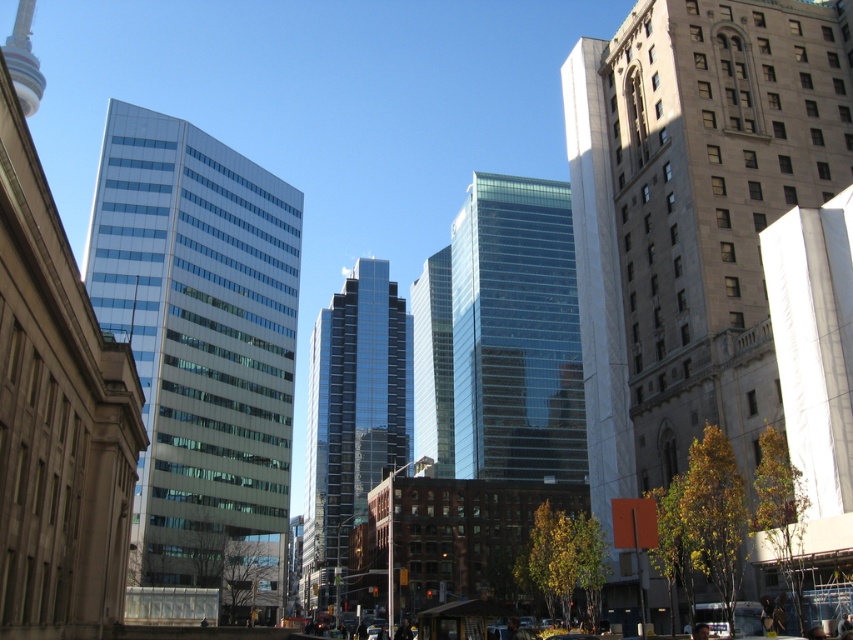
Is transparent glass building at center to the right of shiny glass skyscraper at center from the viewer's perspective?

Correct, you'll find transparent glass building at center to the right of shiny glass skyscraper at center.

Which is below, transparent glass building at center or shiny glass skyscraper at center?

Positioned lower is shiny glass skyscraper at center.

Does point (450, 237) come farther from viewer compared to point (387, 396)?

Yes.

Locate an element on the screen. This screenshot has height=640, width=853. transparent glass building at center is located at coordinates (515, 332).

Which is behind, point (177, 477) or point (567, 445)?

Point (567, 445)

What do you see at coordinates (201, 349) in the screenshot?
I see `matte glass building at left` at bounding box center [201, 349].

Locate an element on the screen. This screenshot has height=640, width=853. matte glass building at left is located at coordinates (x=201, y=349).

Where is `matte glass building at left`? This screenshot has height=640, width=853. matte glass building at left is located at coordinates (201, 349).

Which is in front, point (242, 230) or point (593, 464)?

Point (593, 464) is in front.

Who is positioned more to the left, matte glass building at left or white marble skyscraper at center?

matte glass building at left

This screenshot has width=853, height=640. What do you see at coordinates (201, 349) in the screenshot? I see `matte glass building at left` at bounding box center [201, 349].

You are a GUI agent. You are given a task and a screenshot of the screen. Output one action in this format:
    pyautogui.click(x=<x>, y=<y>)
    Task: Click on the matte glass building at left
    The width and height of the screenshot is (853, 640).
    Given the screenshot: What is the action you would take?
    pyautogui.click(x=201, y=349)